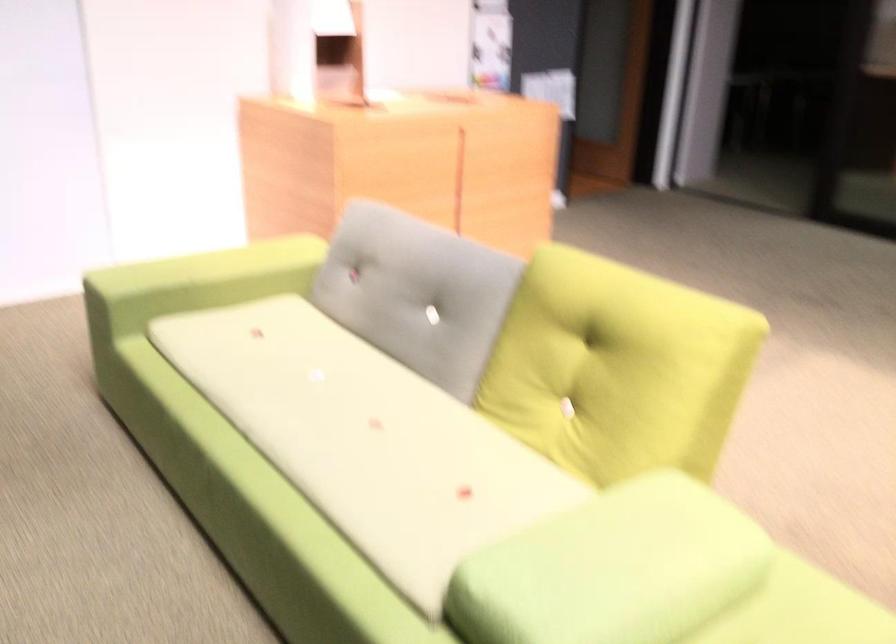
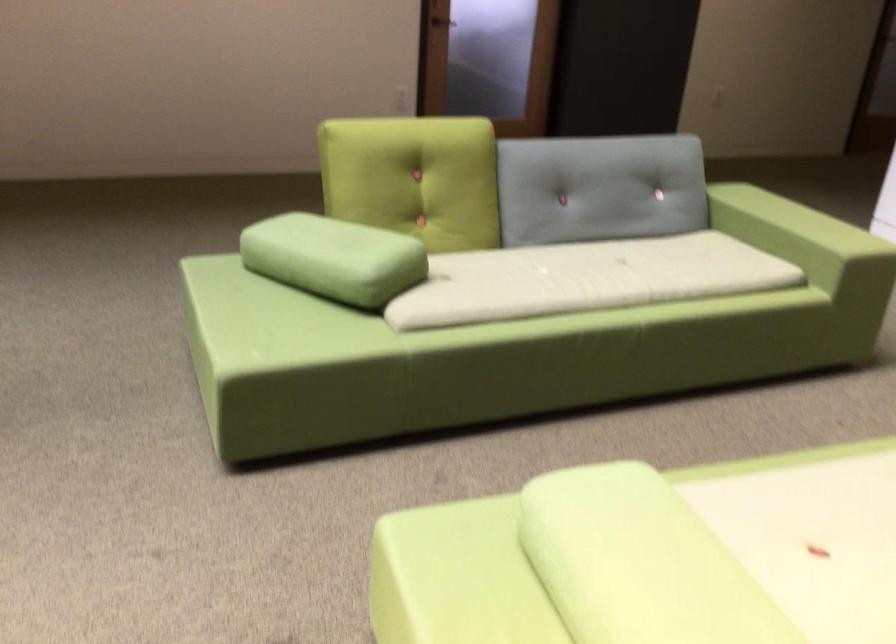
In the second image, find the point that corresponds to pixel 638 550 in the first image.

(639, 563)